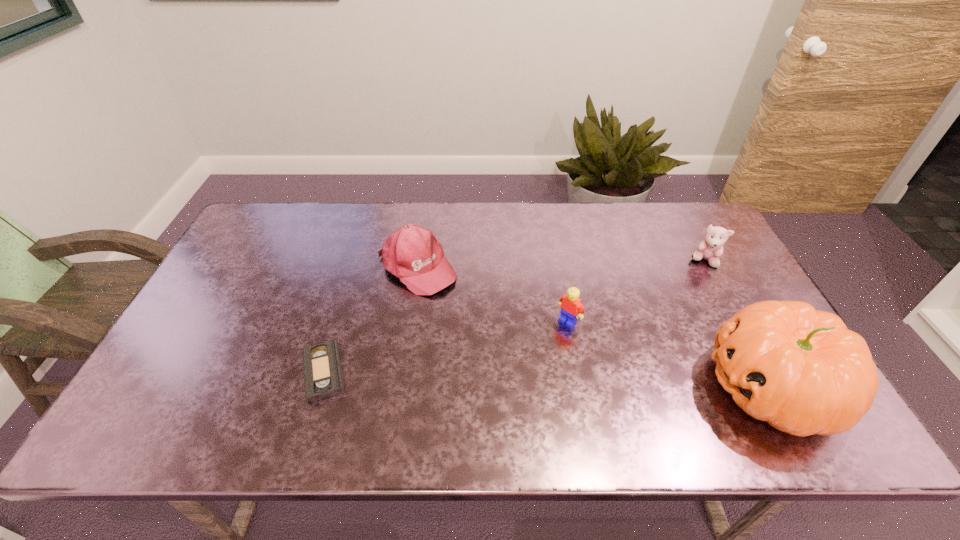
Image resolution: width=960 pixels, height=540 pixels. Identify the location of vacant space located on the front-facing side of the Lego. (550, 339).

Where is `vacant space located on the front-facing side of the Lego`? This screenshot has height=540, width=960. vacant space located on the front-facing side of the Lego is located at coordinates (492, 396).

I want to click on free space located on the front-facing side of the Lego, so coord(543,346).

Find the location of a particular element. This screenshot has width=960, height=540. vacant space located 0.330m at the face of the teddy bear is located at coordinates (633, 319).

At what (x,y) coordinates should I click in order to perform the action: click on vacant space located 0.250m at the face of the teddy bear. Please return your answer as a coordinate pair (x, y). The width and height of the screenshot is (960, 540). Looking at the image, I should click on [x=650, y=305].

This screenshot has width=960, height=540. Identify the location of vacant region located at the face of the teddy bear. (652, 303).

Identify the location of vacant space located 0.060m at the front of the baseball cap with the brim. (452, 302).

Where is `free space located 0.060m at the front of the baseball cap with the brim`? The width and height of the screenshot is (960, 540). free space located 0.060m at the front of the baseball cap with the brim is located at coordinates (452, 302).

Where is `free point located at the front of the baseball cap with the brim`? This screenshot has height=540, width=960. free point located at the front of the baseball cap with the brim is located at coordinates (516, 364).

I want to click on object at the far edge, so click(x=412, y=253).